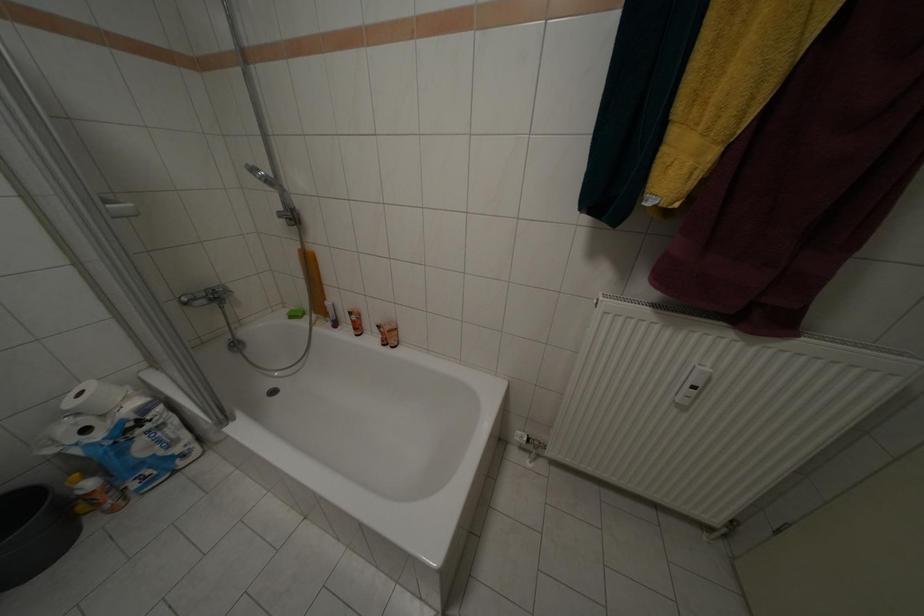
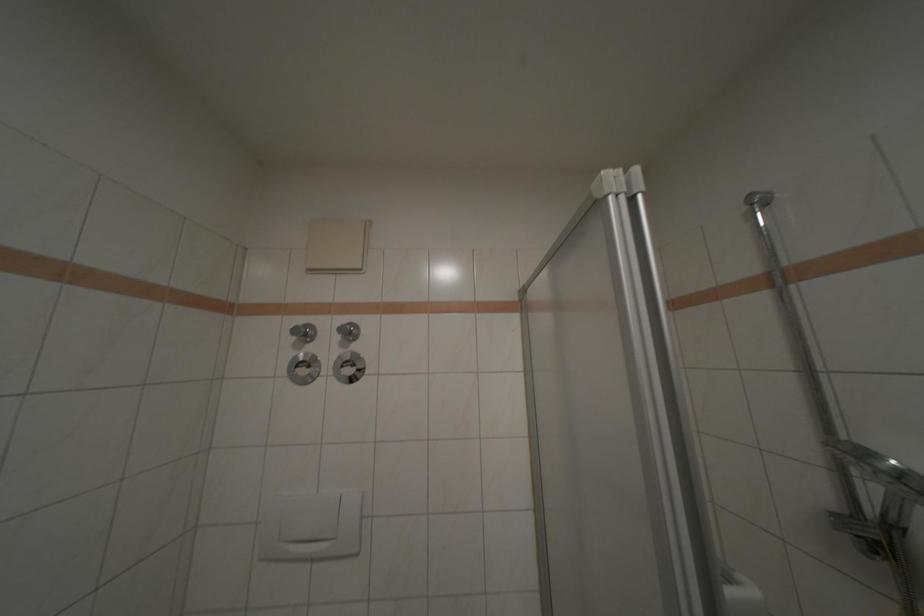
Looking at this image, the images are taken continuously from a first-person perspective. In which direction is your viewpoint rotating?

The camera rotated toward left-up.